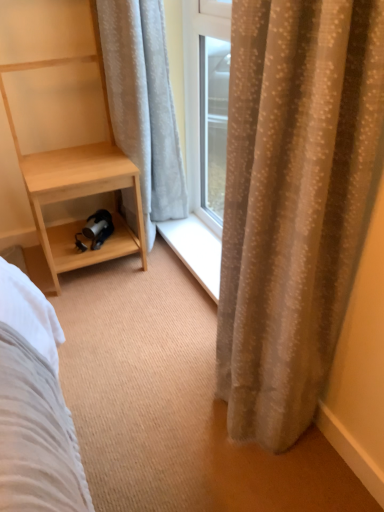
Locate an element on the screen. blank area to the left of beige textured curtain at right, positioned as the 1th curtain in front-to-back order is located at coordinates (135, 396).